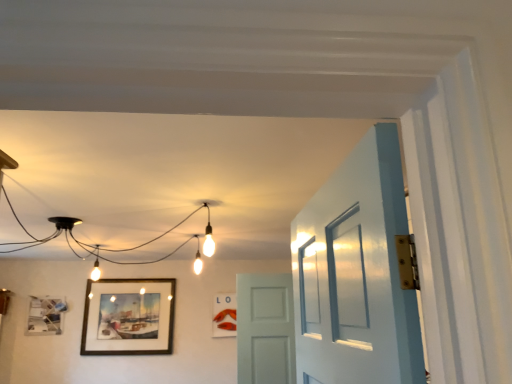
Question: Should I look upward or downward to see matte black picture frame at upper left, placed as the first picture frame when sorted from left to right?

Choices:
 (A) down
 (B) up

Answer: (A)

Question: From a real-world perspective, is matte wooden picture frame at center, which ranks as the 3th picture frame in left-to-right order, physically above matte black picture frame at upper left, the third picture frame in the right-to-left sequence?

Choices:
 (A) no
 (B) yes

Answer: (A)

Question: Does matte wooden picture frame at center, which ranks as the 3th picture frame in left-to-right order, have a lesser width compared to matte black picture frame at upper left, the third picture frame in the right-to-left sequence?

Choices:
 (A) no
 (B) yes

Answer: (B)

Question: Would you say matte black picture frame at upper left, placed as the first picture frame when sorted from left to right, is part of matte wooden picture frame at center, which ranks as the 3th picture frame in left-to-right order,'s contents?

Choices:
 (A) no
 (B) yes

Answer: (A)

Question: Considering the relative positions of matte wooden picture frame at center, which ranks as the 3th picture frame in left-to-right order, and matte black picture frame at upper left, placed as the first picture frame when sorted from left to right, in the image provided, is matte wooden picture frame at center, which ranks as the 3th picture frame in left-to-right order, behind matte black picture frame at upper left, placed as the first picture frame when sorted from left to right,?

Choices:
 (A) no
 (B) yes

Answer: (B)

Question: From the image's perspective, is matte wooden picture frame at center, which ranks as the 3th picture frame in left-to-right order, on top of matte black picture frame at upper left, the third picture frame in the right-to-left sequence?

Choices:
 (A) no
 (B) yes

Answer: (A)

Question: Is matte wooden picture frame at center, the first picture frame when ordered from right to left, positioned before matte black picture frame at upper left, the third picture frame in the right-to-left sequence?

Choices:
 (A) yes
 (B) no

Answer: (B)

Question: Is matte black picture frame at upper left, placed as the first picture frame when sorted from left to right, positioned before matte wooden picture frame at center, the first picture frame when ordered from right to left?

Choices:
 (A) yes
 (B) no

Answer: (A)

Question: From a real-world perspective, is matte black picture frame at upper left, the third picture frame in the right-to-left sequence, beneath matte wooden picture frame at center, which ranks as the 3th picture frame in left-to-right order?

Choices:
 (A) no
 (B) yes

Answer: (A)

Question: Is matte black picture frame at upper left, placed as the first picture frame when sorted from left to right, positioned far away from matte wooden picture frame at center, the first picture frame when ordered from right to left?

Choices:
 (A) yes
 (B) no

Answer: (A)

Question: Is matte black picture frame at upper left, placed as the first picture frame when sorted from left to right, bigger than matte wooden picture frame at center, which ranks as the 3th picture frame in left-to-right order?

Choices:
 (A) yes
 (B) no

Answer: (A)

Question: Can you confirm if matte black picture frame at upper left, the third picture frame in the right-to-left sequence, is smaller than matte wooden picture frame at center, the first picture frame when ordered from right to left?

Choices:
 (A) yes
 (B) no

Answer: (B)

Question: Can you confirm if matte black picture frame at upper left, placed as the first picture frame when sorted from left to right, is positioned to the right of matte wooden picture frame at center, which ranks as the 3th picture frame in left-to-right order?

Choices:
 (A) yes
 (B) no

Answer: (B)

Question: Would you say white matte door at center contains wooden framed painting at lower left, acting as the second picture frame starting from the left?

Choices:
 (A) no
 (B) yes

Answer: (A)